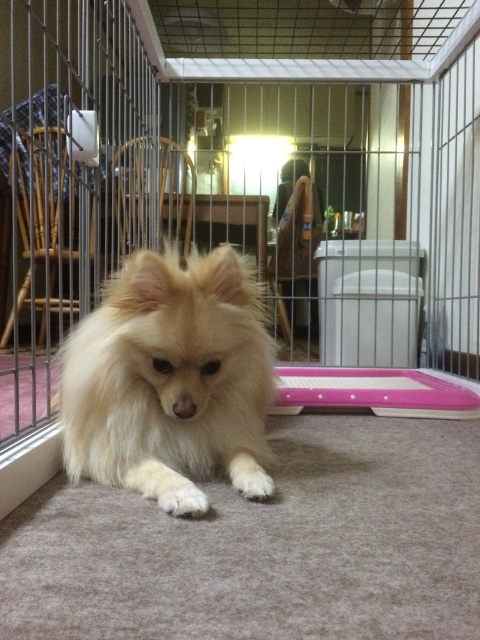
From the picture: You are a small fluffy dog inside a cage and you see the transparent glass door at center and the fluffy white dog at center. Which one is closer to the top of the cage?

The transparent glass door at center is above the fluffy white dog at center, so the transparent glass door at center is closer to the top of the cage.

You are a delivery person who needs to place a package in the cage. The package is 8 feet long. Can you fit the package horizontally between the transparent glass door at center and the camera?

The distance between the transparent glass door at center and the camera is 8.35 feet, so the 8 feet long package can fit horizontally between them since it is shorter than the available space.